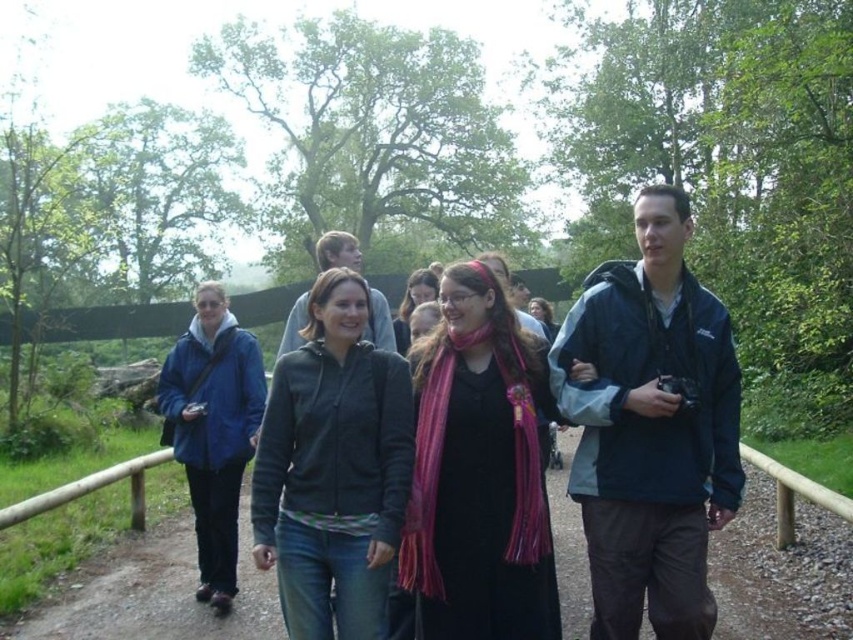
Question: Which of the following is the closest to the observer?

Choices:
 (A) matte black jacket at center
 (B) blue fabric jacket at center

Answer: (B)

Question: Which of the following is the farthest from the observer?

Choices:
 (A) (337, 246)
 (B) (325, 387)
 (C) (106, 611)

Answer: (C)

Question: Does blue fabric jacket at center have a smaller size compared to matte black jacket at center?

Choices:
 (A) yes
 (B) no

Answer: (A)

Question: Does wooden rail at center have a smaller size compared to matte black jacket at center?

Choices:
 (A) yes
 (B) no

Answer: (A)

Question: Which object appears farthest from the camera in this image?

Choices:
 (A) blue matte jacket at left
 (B) pink striped scarf at center
 (C) wooden rail at center
 (D) dark gray zip-up jacket at center

Answer: (C)

Question: Can you confirm if pink striped scarf at center is bigger than dark gray zip-up jacket at center?

Choices:
 (A) yes
 (B) no

Answer: (A)